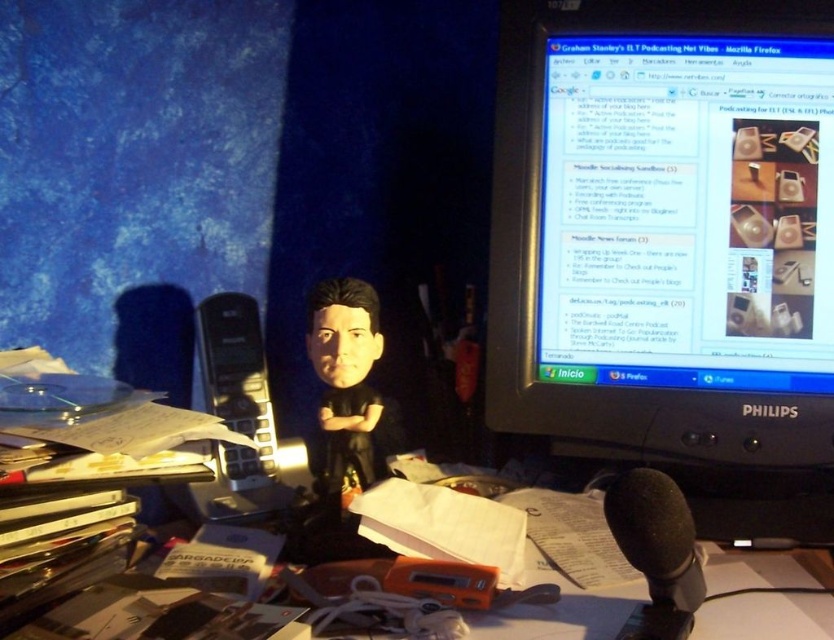
Which is in front, point (719, 212) or point (661, 577)?

Point (661, 577)

The height and width of the screenshot is (640, 834). In order to click on black plastic monitor at upper right in this screenshot , I will do `click(671, 246)`.

What do you see at coordinates (164, 616) in the screenshot?
I see `matte black microphone at center` at bounding box center [164, 616].

Can you confirm if matte black microphone at center is positioned above black matte microphone at center?

Actually, matte black microphone at center is below black matte microphone at center.

Does point (290, 627) lie behind point (652, 516)?

Yes, it is behind point (652, 516).

The height and width of the screenshot is (640, 834). In order to click on matte black microphone at center in this screenshot , I will do `click(164, 616)`.

Does point (817, 419) come in front of point (244, 616)?

No.

Where is `black plastic monitor at upper right`? The width and height of the screenshot is (834, 640). black plastic monitor at upper right is located at coordinates pyautogui.click(x=671, y=246).